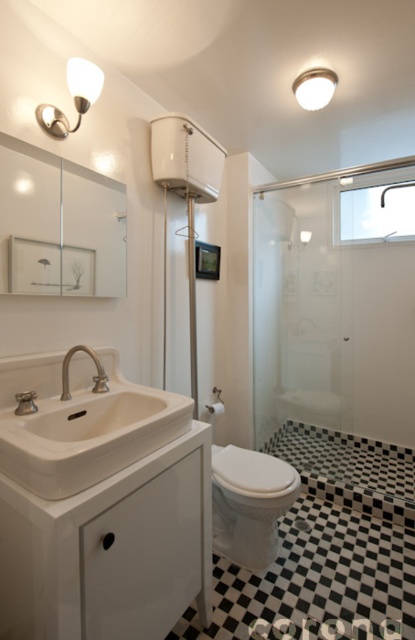
Question: Is white ceramic sink at lower left bigger than white frosted glass dome at upper center?

Choices:
 (A) yes
 (B) no

Answer: (A)

Question: Among these objects, which one is nearest to the camera?

Choices:
 (A) white frosted glass dome at upper center
 (B) transparent glass shower door at center
 (C) brushed nickel faucet at sink left

Answer: (C)

Question: Does white glossy toilet at center appear on the left side of matte white sconce at upper left?

Choices:
 (A) no
 (B) yes

Answer: (A)

Question: Is white glossy toilet at center thinner than brushed nickel faucet at sink left?

Choices:
 (A) yes
 (B) no

Answer: (B)

Question: Among these points, which one is farthest from the camera?

Choices:
 (A) (65, 136)
 (B) (63, 394)

Answer: (A)

Question: Which of the following is the farthest from the observer?

Choices:
 (A) (97, 387)
 (B) (251, 557)

Answer: (B)